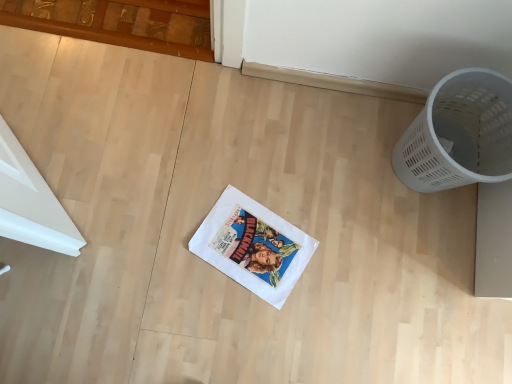
What are the coordinates of `vacant space that is in between white plastic basket at right and white paper comic book at center` in the screenshot? It's located at (339, 207).